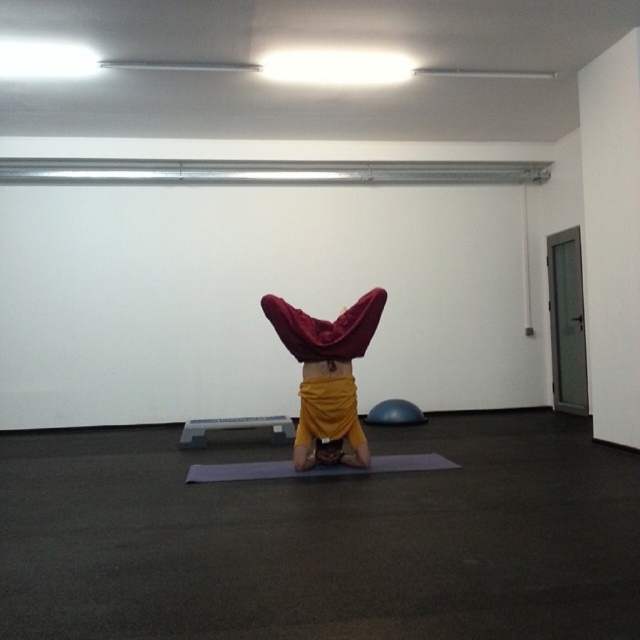
You are an interior designer planning to add more color to the studio. You notice the velvet red cloth at center and the gray rubber yoga mat at center. Which object is covering the other one?

The velvet red cloth at center is positioned over the gray rubber yoga mat at center, so it is covering the yoga mat.

You are in a yoga studio and see a point marked at coordinates (326, 376). What object is this point located on?

The point is located on the velvet red cloth at center.

You are a fitness instructor preparing a class setup. You have a velvet red cloth at center and a gray plastic lift at center in your studio. Which object has a larger width?

The gray plastic lift at center has a larger width than the velvet red cloth at center.